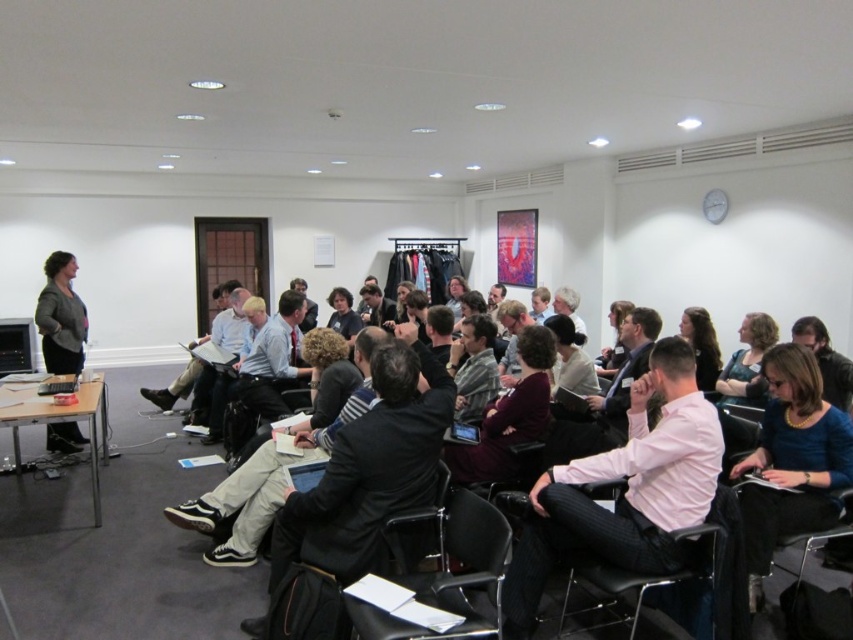
Does blue jersey at center have a greater height compared to black leather chair at center?

Yes.

Describe the element at coordinates (792, 460) in the screenshot. The height and width of the screenshot is (640, 853). I see `blue jersey at center` at that location.

The height and width of the screenshot is (640, 853). Find the location of `blue jersey at center`. blue jersey at center is located at coordinates (792, 460).

Does blue jersey at center have a larger size compared to black leather chair at lower center?

Yes.

Between blue jersey at center and black leather chair at lower center, which one appears on the left side from the viewer's perspective?

Positioned to the left is black leather chair at lower center.

Is point (805, 522) in front of point (486, 513)?

No.

I want to click on blue jersey at center, so click(792, 460).

Is point (558, 499) closer to viewer compared to point (834, 413)?

Yes.

Can you confirm if pink shirt at center is wider than blue jersey at center?

Correct, the width of pink shirt at center exceeds that of blue jersey at center.

Does point (663, 500) come closer to viewer compared to point (784, 422)?

Yes, point (663, 500) is in front of point (784, 422).

Locate an element on the screen. This screenshot has width=853, height=640. pink shirt at center is located at coordinates (624, 492).